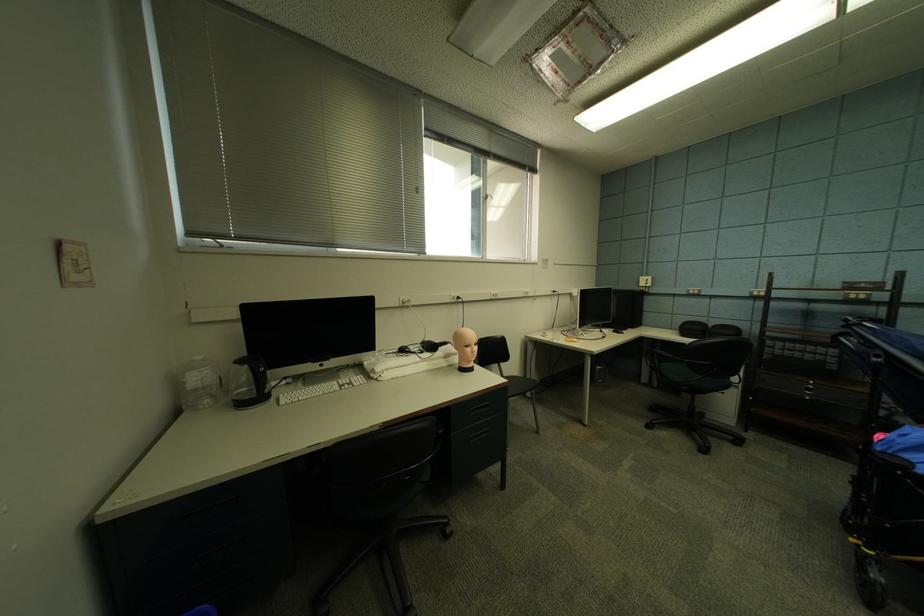
Describe the element at coordinates (259, 369) in the screenshot. I see `the black kettle handle` at that location.